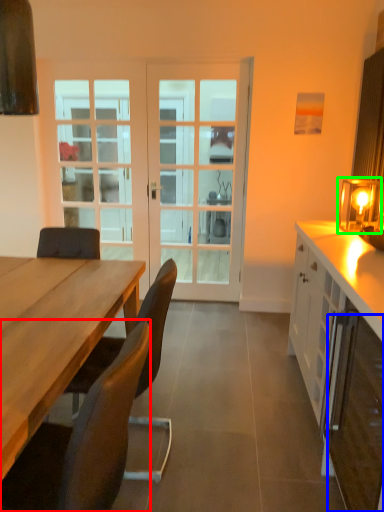
Question: Which object is positioned farthest from chair (highlighted by a red box)? Select from cabinetry (highlighted by a blue box) and table lamp (highlighted by a green box).

Choices:
 (A) cabinetry
 (B) table lamp

Answer: (B)